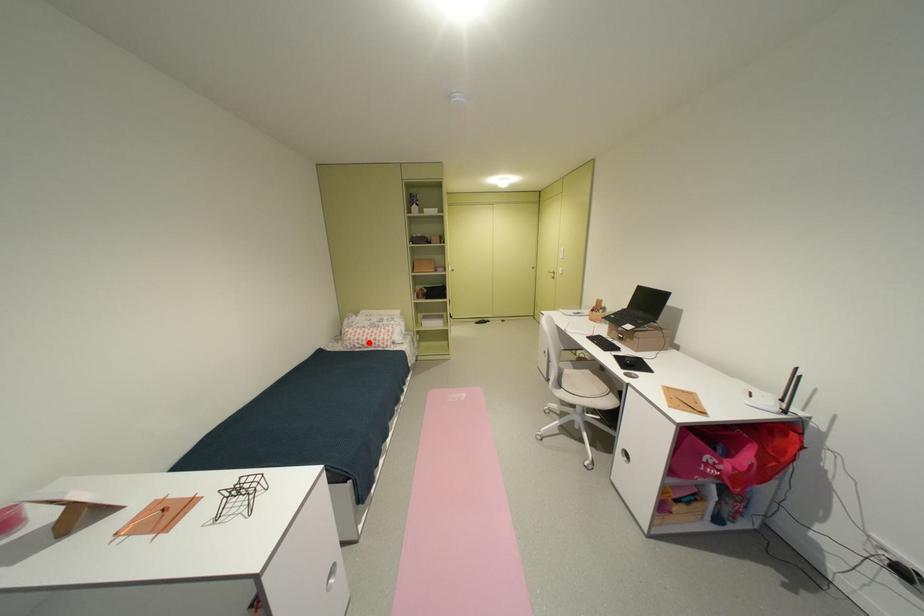
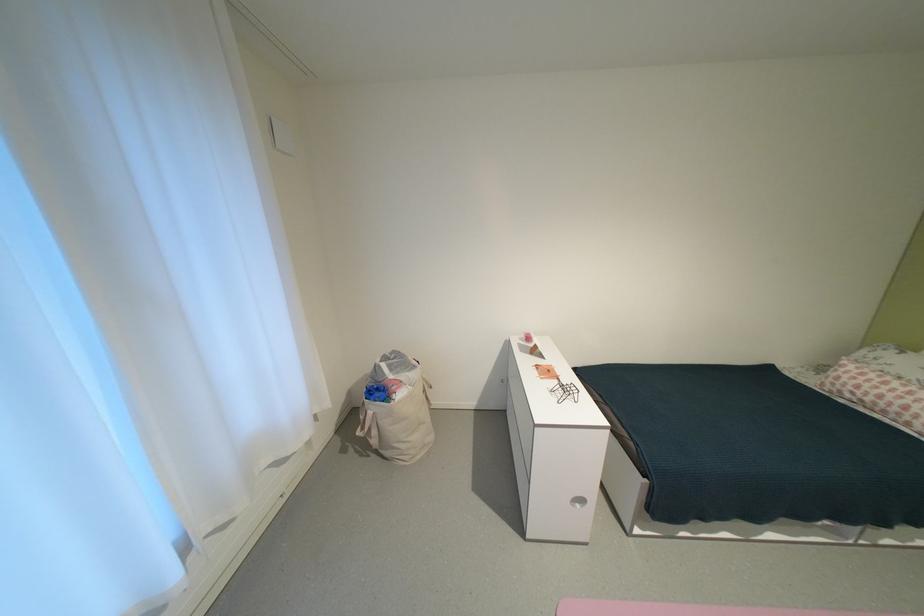
Locate, in the second image, the point that corresponds to the highlighted location in the first image.

(867, 392)